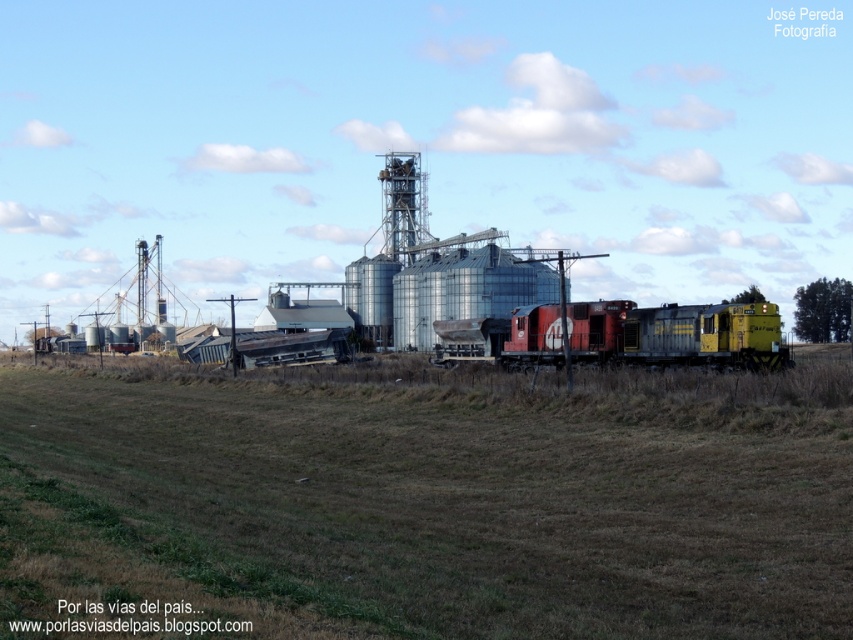
Who is higher up, brown grass at center or red/yellow painted metal train at center?

Positioned higher is red/yellow painted metal train at center.

Can you confirm if brown grass at center is taller than red/yellow painted metal train at center?

Indeed, brown grass at center has a greater height compared to red/yellow painted metal train at center.

Describe the element at coordinates (432, 499) in the screenshot. I see `brown grass at center` at that location.

Locate an element on the screen. Image resolution: width=853 pixels, height=640 pixels. brown grass at center is located at coordinates (432, 499).